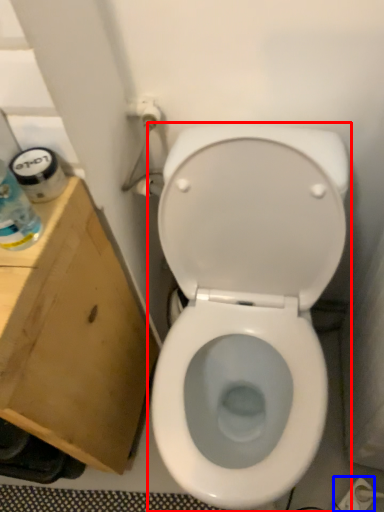
Question: Which object is closer to the camera taking this photo, toilet (highlighted by a red box) or electric outlet (highlighted by a blue box)?

Choices:
 (A) toilet
 (B) electric outlet

Answer: (A)